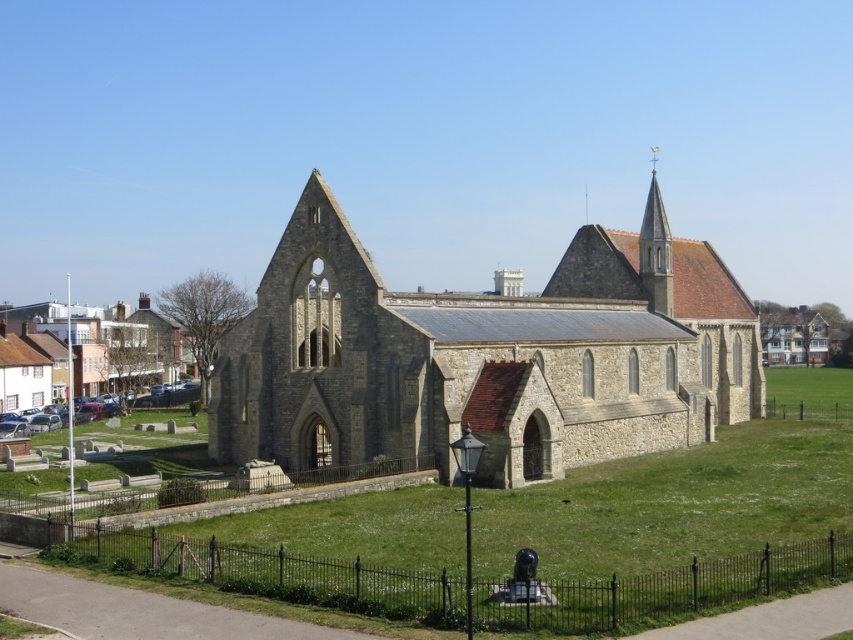
You are standing in front of the historic stone church and want to determine the relative positions of two points marked in the scene. Which of the two points, point(618, 452) or point(657, 294), is closer to you?

Point(618, 452) is closer to the viewer than point(657, 294).

You are visiting a historic site and see the stone church at center and the smooth stone spire at upper right. Which one is positioned more to the left side of the image?

The stone church at center is positioned more to the left side of the image compared to the smooth stone spire at upper right.